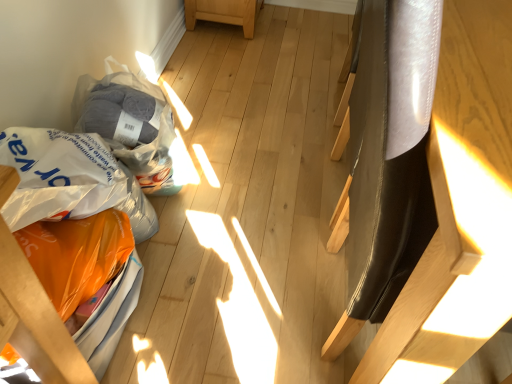
Question: Considering the positions of translucent plastic grocery bag at lower left, the first grocery bag viewed from the top, and orange plastic grocery bag at lower left, the second grocery bag when ordered from top to bottom, in the image, is translucent plastic grocery bag at lower left, the first grocery bag viewed from the top, wider or thinner than orange plastic grocery bag at lower left, the second grocery bag when ordered from top to bottom,?

Choices:
 (A) thin
 (B) wide

Answer: (A)

Question: Relative to orange plastic grocery bag at lower left, the second grocery bag when ordered from top to bottom, is translucent plastic grocery bag at lower left, which ranks as the 2th grocery bag in bottom-to-top order, in front or behind?

Choices:
 (A) behind
 (B) front

Answer: (A)

Question: Which object is positioned closest to the orange plastic grocery bag at lower left, the second grocery bag when ordered from top to bottom?

Choices:
 (A) orange plastic bag at lower left, which ranks as the second furniture in right-to-left order
 (B) shiny black chair at right, which appears as the first furniture when viewed from the right
 (C) translucent plastic grocery bag at lower left, which ranks as the 2th grocery bag in bottom-to-top order

Answer: (A)

Question: Which object is positioned closest to the translucent plastic grocery bag at lower left, the first grocery bag viewed from the top?

Choices:
 (A) shiny black chair at right, the second furniture positioned from the left
 (B) orange plastic grocery bag at lower left, the second grocery bag when ordered from top to bottom
 (C) orange plastic bag at lower left, which ranks as the second furniture in right-to-left order

Answer: (B)